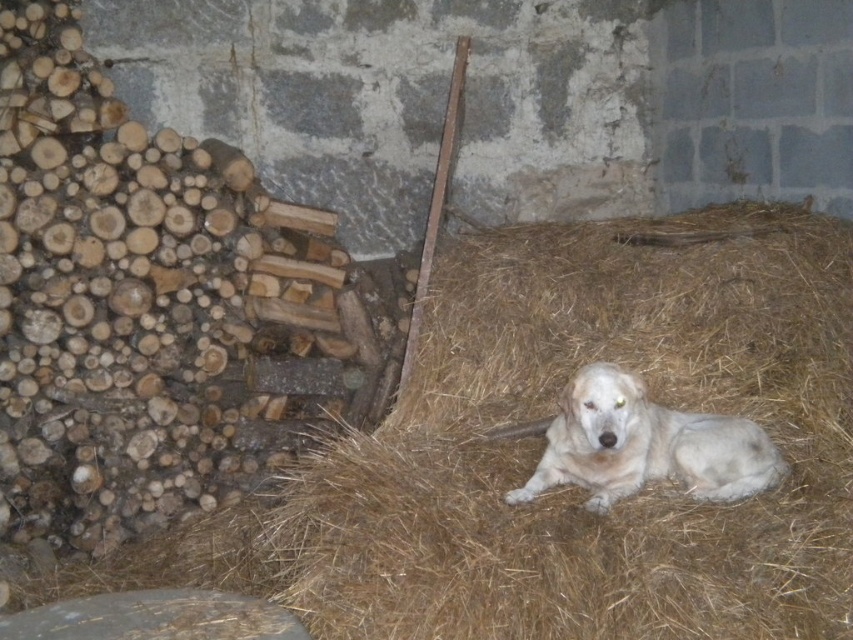
Question: Does brown straw at center have a greater width compared to white fur dog at center?

Choices:
 (A) no
 (B) yes

Answer: (B)

Question: Which of the following is the farthest from the observer?

Choices:
 (A) white fur dog at center
 (B) brown straw at center

Answer: (A)

Question: Can you confirm if brown straw at center is wider than white fur dog at center?

Choices:
 (A) yes
 (B) no

Answer: (A)

Question: Where is brown straw at center located in relation to white fur dog at center in the image?

Choices:
 (A) below
 (B) above

Answer: (A)